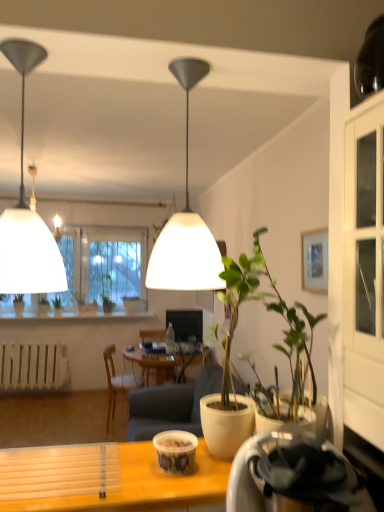
At what (x,y) coordinates should I click in order to perform the action: click on matte white lampshade at upper left, which ranks as the second lamp in right-to-left order. Please return your answer as a coordinate pair (x, y). The width and height of the screenshot is (384, 512). Looking at the image, I should click on (27, 211).

This screenshot has height=512, width=384. What do you see at coordinates (229, 359) in the screenshot?
I see `green matte plant at center, which is the fourth houseplant in left-to-right order` at bounding box center [229, 359].

This screenshot has height=512, width=384. Find the location of `green matte plant at lower left, which is the second houseplant from front to back`. green matte plant at lower left, which is the second houseplant from front to back is located at coordinates (57, 305).

This screenshot has height=512, width=384. What are the coordinates of `transparent glass window at left` in the screenshot? It's located at tap(104, 267).

Where is `white matte lampshade at center, marked as the 1th lamp in a right-to-left arrangement`? This screenshot has height=512, width=384. white matte lampshade at center, marked as the 1th lamp in a right-to-left arrangement is located at coordinates (186, 222).

From the image's perspective, is green leafy plant at center, the second houseplant positioned from the right, positioned above or below white matte radiator at lower left?

green leafy plant at center, the second houseplant positioned from the right, is situated higher than white matte radiator at lower left in the image.

Which is in front, point (111, 301) or point (54, 378)?

The point (54, 378) is in front.

Are green leafy plant at center, the 1th houseplant from the back, and white matte radiator at lower left far apart?

That's right, there is a large distance between green leafy plant at center, the 1th houseplant from the back, and white matte radiator at lower left.

How many degrees apart are the facing directions of green leafy plant at center, arranged as the 3th houseplant when viewed from the left, and white matte radiator at lower left?

The angle between the facing direction of green leafy plant at center, arranged as the 3th houseplant when viewed from the left, and the facing direction of white matte radiator at lower left is 1 degrees.

Which is nearer, (158, 469) or (12, 359)?

Point (158, 469) is positioned closer to the camera compared to point (12, 359).

Consider the image. Is wooden desk at lower center facing away from white matte radiator at lower left?

wooden desk at lower center does not have its back to white matte radiator at lower left.

How different are the orientations of wooden desk at lower center and white matte radiator at lower left in degrees?

0.433 degrees separate the facing orientations of wooden desk at lower center and white matte radiator at lower left.

Who is shorter, matte white lampshade at upper left, placed as the 1th lamp when sorted from left to right, or transparent glass window at left?

With less height is matte white lampshade at upper left, placed as the 1th lamp when sorted from left to right.

Is matte white lampshade at upper left, placed as the 1th lamp when sorted from left to right, oriented away from transparent glass window at left?

Correct, matte white lampshade at upper left, placed as the 1th lamp when sorted from left to right, is looking away from transparent glass window at left.

From a real-world perspective, which is physically above, matte white lampshade at upper left, placed as the 1th lamp when sorted from left to right, or transparent glass window at left?

From a 3D spatial view, matte white lampshade at upper left, placed as the 1th lamp when sorted from left to right, is above.

Is matte white lampshade at upper left, placed as the 1th lamp when sorted from left to right, inside the boundaries of transparent glass window at left, or outside?

matte white lampshade at upper left, placed as the 1th lamp when sorted from left to right, is located beyond the bounds of transparent glass window at left.

Is wooden desk at lower center at the right side of transparent glass window at left?

Correct, you'll find wooden desk at lower center to the right of transparent glass window at left.

How different are the orientations of wooden desk at lower center and transparent glass window at left in degrees?

The angle between the facing direction of wooden desk at lower center and the facing direction of transparent glass window at left is 1.14 degrees.

Would you say wooden desk at lower center is inside or outside transparent glass window at left?

wooden desk at lower center exists outside the volume of transparent glass window at left.

Locate an element on the screen. window located above the wooden desk at lower center (from a real-world perspective) is located at coordinates (104, 267).

Considering the sizes of objects transparent glass window at left and green matte plant at center, which is the fourth houseplant in left-to-right order, in the image provided, who is shorter, transparent glass window at left or green matte plant at center, which is the fourth houseplant in left-to-right order,?

green matte plant at center, which is the fourth houseplant in left-to-right order, is shorter.

Does point (140, 309) come farther from viewer compared to point (223, 457)?

Yes, point (140, 309) is farther from viewer.

Is transparent glass window at left beside green matte plant at center, the fourth houseplant in the back-to-front sequence?

There is a gap between transparent glass window at left and green matte plant at center, the fourth houseplant in the back-to-front sequence.

Is transparent glass window at left in front of or behind green matte plant at center, which is the fourth houseplant in left-to-right order, in the image?

transparent glass window at left is behind green matte plant at center, which is the fourth houseplant in left-to-right order.

Between matte plastic cup at center and white matte lampshade at center, the 2th lamp when ordered from left to right, which one has more height?

With more height is white matte lampshade at center, the 2th lamp when ordered from left to right.

From the image's perspective, who appears lower, matte plastic cup at center or white matte lampshade at center, the 2th lamp when ordered from left to right?

matte plastic cup at center appears lower in the image.

Is matte plastic cup at center positioned in front of white matte lampshade at center, the 2th lamp when ordered from left to right?

No, it is behind white matte lampshade at center, the 2th lamp when ordered from left to right.

Is transparent glass window at left a part of green matte plant at center, which ranks as the third houseplant in right-to-left order?

No, transparent glass window at left is not inside green matte plant at center, which ranks as the third houseplant in right-to-left order.

Is transparent glass window at left at the back of green matte plant at center, which ranks as the third houseplant in right-to-left order?

That's right, green matte plant at center, which ranks as the third houseplant in right-to-left order, is facing away from transparent glass window at left.

Does point (96, 302) come behind point (142, 249)?

That is False.

Which object is closer to the camera, green matte plant at center, the 3th houseplant from the front, or transparent glass window at left?

transparent glass window at left is more forward.

Identify the location of radiator in front of the green leafy plant at center, the 1th houseplant from the back. The width and height of the screenshot is (384, 512). (33, 366).

You are a GUI agent. You are given a task and a screenshot of the screen. Output one action in this format:
    pyautogui.click(x=<x>, y=<y>)
    Task: Click on the desk located above the white matte radiator at lower left (from the image's perspective)
    
    Given the screenshot: What is the action you would take?
    pyautogui.click(x=109, y=479)

From the image, which object appears to be nearer to green matte plant at lower left, which is counted as the 1th houseplant, starting from the left, wooden chair at center or green matte plant at center, the fourth houseplant in the back-to-front sequence?

wooden chair at center is positioned closer to the anchor green matte plant at lower left, which is counted as the 1th houseplant, starting from the left.

From the image, which object appears to be farther from green matte plant at center, the fourth houseplant in the back-to-front sequence, green matte plant at center, which ranks as the third houseplant in right-to-left order, or white matte radiator at lower left?

Among the two, green matte plant at center, which ranks as the third houseplant in right-to-left order, is located further to green matte plant at center, the fourth houseplant in the back-to-front sequence.

Which object lies further to the anchor point green matte plant at center, the 2th houseplant from the left, white matte lampshade at center, the 2th lamp when ordered from left to right, or wooden desk at lower center?

wooden desk at lower center is positioned further to the anchor green matte plant at center, the 2th houseplant from the left.

When comparing their distances from green matte plant at center, the 2th houseplant viewed from the back, does matte white lampshade at upper left, which ranks as the second lamp in right-to-left order, or transparent glass window at left seem further?

matte white lampshade at upper left, which ranks as the second lamp in right-to-left order, lies further to green matte plant at center, the 2th houseplant viewed from the back, than the other object.

Which object lies further to the anchor point matte white lampshade at upper left, which ranks as the second lamp in right-to-left order, green matte plant at center, the 2th houseplant viewed from the back, or wooden desk at lower center?

green matte plant at center, the 2th houseplant viewed from the back, is further to matte white lampshade at upper left, which ranks as the second lamp in right-to-left order.

From the image, which object appears to be farther from matte white lampshade at upper left, which ranks as the second lamp in right-to-left order, white ceramic flowerpot at center or wooden desk at lower center?

Among the two, white ceramic flowerpot at center is located further to matte white lampshade at upper left, which ranks as the second lamp in right-to-left order.

Looking at this image, from the image, which object appears to be farther from matte white lampshade at upper left, which ranks as the second lamp in right-to-left order, wooden desk at lower center or white matte lampshade at center, the 2th lamp when ordered from left to right?

wooden desk at lower center is further to matte white lampshade at upper left, which ranks as the second lamp in right-to-left order.

Looking at the image, which one is located further to green matte plant at center, which is the fourth houseplant in left-to-right order, matte plastic cup at center or matte white lampshade at upper left, which ranks as the second lamp in right-to-left order?

Based on the image, matte white lampshade at upper left, which ranks as the second lamp in right-to-left order, appears to be further to green matte plant at center, which is the fourth houseplant in left-to-right order.

Where is `coffee cup between white matte lampshade at center, marked as the 1th lamp in a right-to-left arrangement, and wooden chair at center from front to back`? coffee cup between white matte lampshade at center, marked as the 1th lamp in a right-to-left arrangement, and wooden chair at center from front to back is located at coordinates (176, 451).

Locate an element on the screen. chair located between white matte lampshade at center, marked as the 1th lamp in a right-to-left arrangement, and white matte radiator at lower left in the depth direction is located at coordinates (118, 382).

The height and width of the screenshot is (512, 384). Identify the location of lamp between matte white lampshade at upper left, placed as the 1th lamp when sorted from left to right, and wooden desk at lower center in the up-down direction. (186, 222).

Locate an element on the screen. This screenshot has width=384, height=512. window situated between green matte plant at lower left, which ranks as the fourth houseplant in right-to-left order, and white ceramic flowerpot at center from left to right is located at coordinates (104, 267).